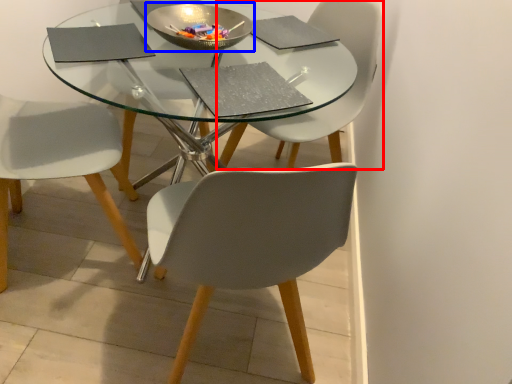
Question: Which of the following is the farthest to the observer, chair (highlighted by a red box) or bowl (highlighted by a blue box)?

Choices:
 (A) chair
 (B) bowl

Answer: (A)